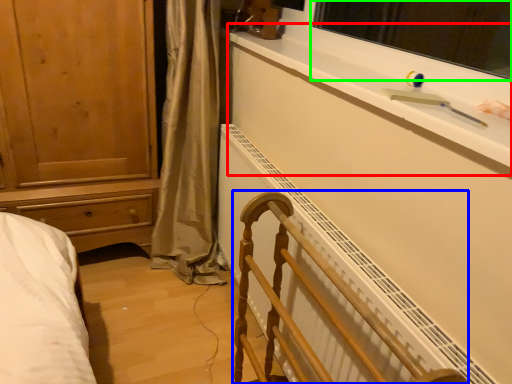
Question: Considering the real-world distances, which object is closest to window sill (highlighted by a red box)? furniture (highlighted by a blue box) or window screen (highlighted by a green box).

Choices:
 (A) furniture
 (B) window screen

Answer: (A)